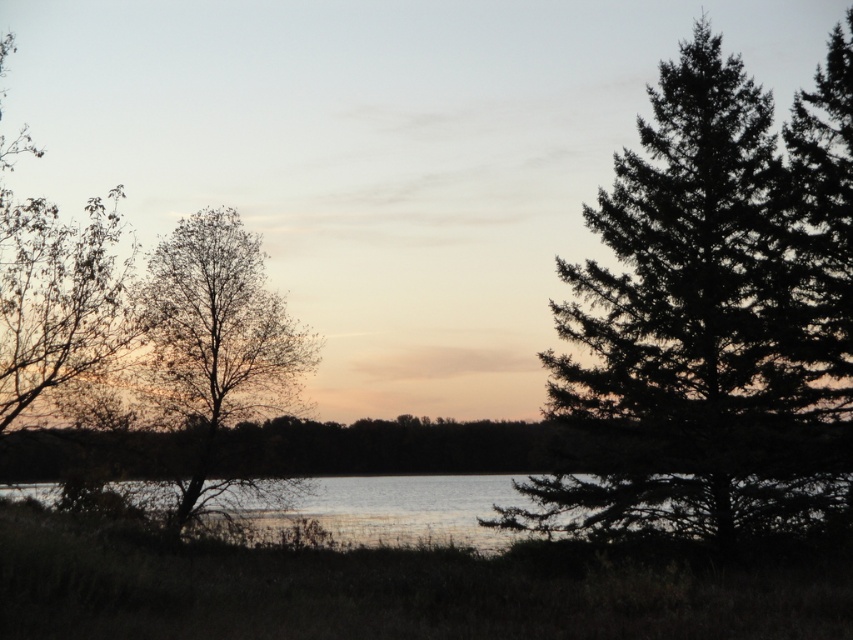
Can you confirm if brown leafy tree at left is smaller than clear water at center?

No.

Between brown leafy tree at left and clear water at center, which one is positioned lower?

clear water at center is lower down.

Identify the location of brown leafy tree at left. Image resolution: width=853 pixels, height=640 pixels. (56, 292).

Does point (169, 326) come behind point (53, 352)?

Yes, point (169, 326) is behind point (53, 352).

Which is behind, point (200, 276) or point (97, 198)?

Positioned behind is point (200, 276).

Image resolution: width=853 pixels, height=640 pixels. What are the coordinates of `bare branches at left` in the screenshot? It's located at (216, 340).

Can you confirm if dark green textured pine tree at right is positioned above brown leafy tree at left?

Indeed, dark green textured pine tree at right is positioned over brown leafy tree at left.

Is dark green textured pine tree at right to the left of brown leafy tree at left from the viewer's perspective?

Incorrect, dark green textured pine tree at right is not on the left side of brown leafy tree at left.

Is point (659, 116) farther from viewer compared to point (24, 337)?

Yes.

At what (x,y) coordinates should I click in order to perform the action: click on dark green textured pine tree at right. Please return your answer as a coordinate pair (x, y). The width and height of the screenshot is (853, 640). Looking at the image, I should click on (711, 317).